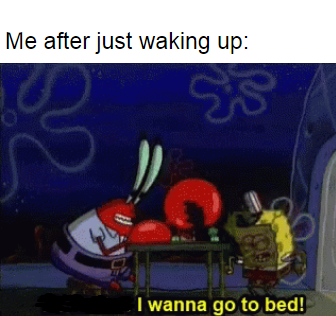
Find the location of a particular element. The height and width of the screenshot is (316, 336). table legs is located at coordinates (134, 266), (147, 268), (210, 270), (223, 271).